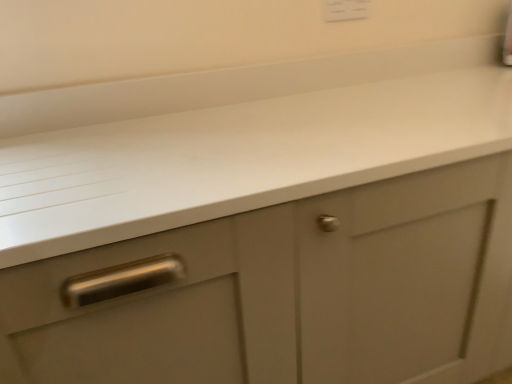
Where is `white matte countertop at center`? This screenshot has width=512, height=384. white matte countertop at center is located at coordinates (237, 140).

This screenshot has width=512, height=384. Describe the element at coordinates (237, 140) in the screenshot. I see `white matte countertop at center` at that location.

What do you see at coordinates (346, 10) in the screenshot? I see `white plastic electric outlet at upper center` at bounding box center [346, 10].

This screenshot has height=384, width=512. I want to click on white plastic electric outlet at upper center, so point(346,10).

The image size is (512, 384). I want to click on white matte countertop at center, so click(237, 140).

Considering the positions of objects white matte countertop at center and white plastic electric outlet at upper center in the image provided, who is more to the left, white matte countertop at center or white plastic electric outlet at upper center?

Positioned to the left is white plastic electric outlet at upper center.

Considering their positions, is white matte countertop at center located in front of or behind white plastic electric outlet at upper center?

Visually, white matte countertop at center is located in front of white plastic electric outlet at upper center.

Is point (428, 131) in front of point (341, 19)?

Yes, it is in front of point (341, 19).

From the image's perspective, is white matte countertop at center above or below white plastic electric outlet at upper center?

From the image's perspective, white matte countertop at center appears below white plastic electric outlet at upper center.

From a real-world perspective, is white matte countertop at center located beneath white plastic electric outlet at upper center?

Yes, from a real-world perspective, white matte countertop at center is under white plastic electric outlet at upper center.

In terms of width, does white matte countertop at center look wider or thinner when compared to white plastic electric outlet at upper center?

In the image, white matte countertop at center appears to be wider than white plastic electric outlet at upper center.

Can you confirm if white matte countertop at center is taller than white plastic electric outlet at upper center?

Correct, white matte countertop at center is much taller as white plastic electric outlet at upper center.

Which of these two, white matte countertop at center or white plastic electric outlet at upper center, is smaller?

white plastic electric outlet at upper center.

Is white plastic electric outlet at upper center surrounded by white matte countertop at center?

No, white matte countertop at center does not contain white plastic electric outlet at upper center.

Is white matte countertop at center placed right next to white plastic electric outlet at upper center?

No, white matte countertop at center is not next to white plastic electric outlet at upper center.

Is white plastic electric outlet at upper center at the back of white matte countertop at center?

No.

Could you measure the distance between white matte countertop at center and white plastic electric outlet at upper center?

white matte countertop at center is 21.82 inches away from white plastic electric outlet at upper center.

The width and height of the screenshot is (512, 384). What are the coordinates of `electric outlet above the white matte countertop at center (from a real-world perspective)` in the screenshot? It's located at (346, 10).

Considering the relative positions of white plastic electric outlet at upper center and white matte countertop at center in the image provided, is white plastic electric outlet at upper center to the right of white matte countertop at center from the viewer's perspective?

In fact, white plastic electric outlet at upper center is to the left of white matte countertop at center.

Relative to white matte countertop at center, is white plastic electric outlet at upper center in front or behind?

white plastic electric outlet at upper center is positioned farther from the viewer than white matte countertop at center.

Is point (354, 17) positioned after point (442, 131)?

Yes, it is behind point (442, 131).

From the image's perspective, is white plastic electric outlet at upper center located beneath white matte countertop at center?

No.

From a real-world perspective, does white plastic electric outlet at upper center stand above white matte countertop at center?

Correct, in the physical world, white plastic electric outlet at upper center is higher than white matte countertop at center.

Looking at their sizes, would you say white plastic electric outlet at upper center is wider or thinner than white matte countertop at center?

Clearly, white plastic electric outlet at upper center has less width compared to white matte countertop at center.

Who is taller, white plastic electric outlet at upper center or white matte countertop at center?

white matte countertop at center is taller.

Consider the image. Which of these two, white plastic electric outlet at upper center or white matte countertop at center, is bigger?

white matte countertop at center.

Can we say white plastic electric outlet at upper center lies outside white matte countertop at center?

Yes, white plastic electric outlet at upper center is located beyond the bounds of white matte countertop at center.

Is white plastic electric outlet at upper center with white matte countertop at center?

white plastic electric outlet at upper center and white matte countertop at center are clearly separated.

Is white plastic electric outlet at upper center facing away from white matte countertop at center?

white plastic electric outlet at upper center does not have its back to white matte countertop at center.

In the scene shown: Can you tell me how much white plastic electric outlet at upper center and white matte countertop at center differ in facing direction?

There is a 1.89-degree angle between the facing directions of white plastic electric outlet at upper center and white matte countertop at center.

Image resolution: width=512 pixels, height=384 pixels. What are the coordinates of `countertop that is under the white plastic electric outlet at upper center (from a real-world perspective)` in the screenshot? It's located at (237, 140).

This screenshot has width=512, height=384. What are the coordinates of `electric outlet located above the white matte countertop at center (from a real-world perspective)` in the screenshot? It's located at (346, 10).

Identify the location of countertop that is below the white plastic electric outlet at upper center (from the image's perspective). (237, 140).